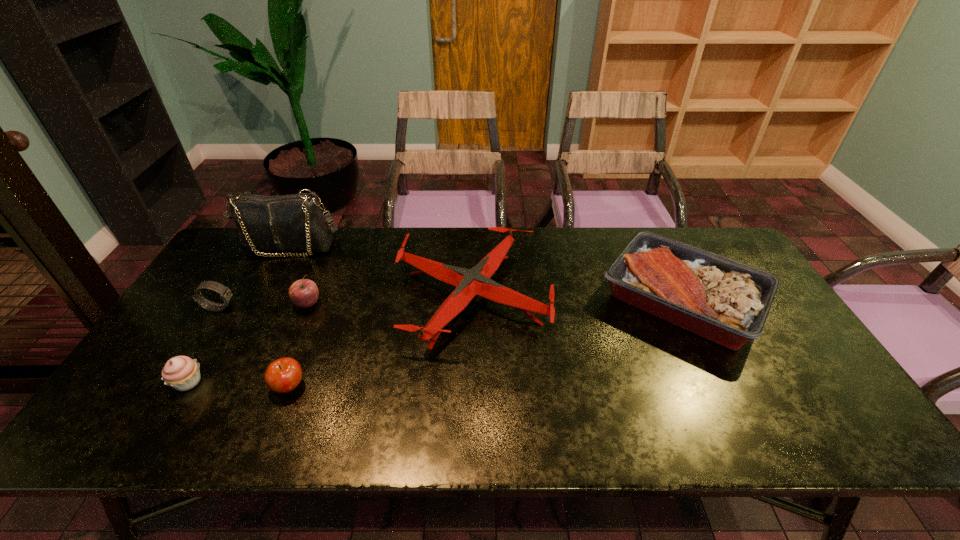
At what (x,y) coordinates should I click in order to perform the action: click on free point between the nearer apple and the cupcake. Please return your answer as a coordinate pair (x, y). The height and width of the screenshot is (540, 960). Looking at the image, I should click on (238, 384).

You are a GUI agent. You are given a task and a screenshot of the screen. Output one action in this format:
    pyautogui.click(x=<x>, y=<y>)
    Task: Click on the free point between the nearer apple and the rightmost object
    
    Given the screenshot: What is the action you would take?
    pyautogui.click(x=485, y=343)

Where is `vacant area between the nearer apple and the tallest object`? The image size is (960, 540). vacant area between the nearer apple and the tallest object is located at coordinates (289, 316).

Where is `free spot between the rightmost object and the nearer apple`? free spot between the rightmost object and the nearer apple is located at coordinates (485, 343).

Locate an element on the screen. The height and width of the screenshot is (540, 960). free space between the cupcake and the watch is located at coordinates (204, 345).

The image size is (960, 540). I want to click on unoccupied position between the sixth object from left to right and the watch, so click(x=346, y=302).

Select which object is the second closest to the cupcake. Please provide its 2D coordinates. Your answer should be formatted as a tuple, i.e. [(x, y)], where the tuple contains the x and y coordinates of a point satisfying the conditions above.

[(225, 293)]

Find the location of a particular element. object that ranks as the closest to the tray is located at coordinates (476, 281).

You are a GUI agent. You are given a task and a screenshot of the screen. Output one action in this format:
    pyautogui.click(x=<x>, y=<y>)
    Task: Click on the vacant space that satisfies the following two spatial constraints: 1. on the back side of the farther apple; 2. on the left side of the cupcake
    
    Given the screenshot: What is the action you would take?
    pyautogui.click(x=234, y=304)

You are a GUI agent. You are given a task and a screenshot of the screen. Output one action in this format:
    pyautogui.click(x=<x>, y=<y>)
    Task: Click on the vacant point that satisfies the following two spatial constraints: 1. at the front of the tallest object with chain and zipper; 2. on the face of the watch
    The height and width of the screenshot is (540, 960).
    Given the screenshot: What is the action you would take?
    [257, 308]